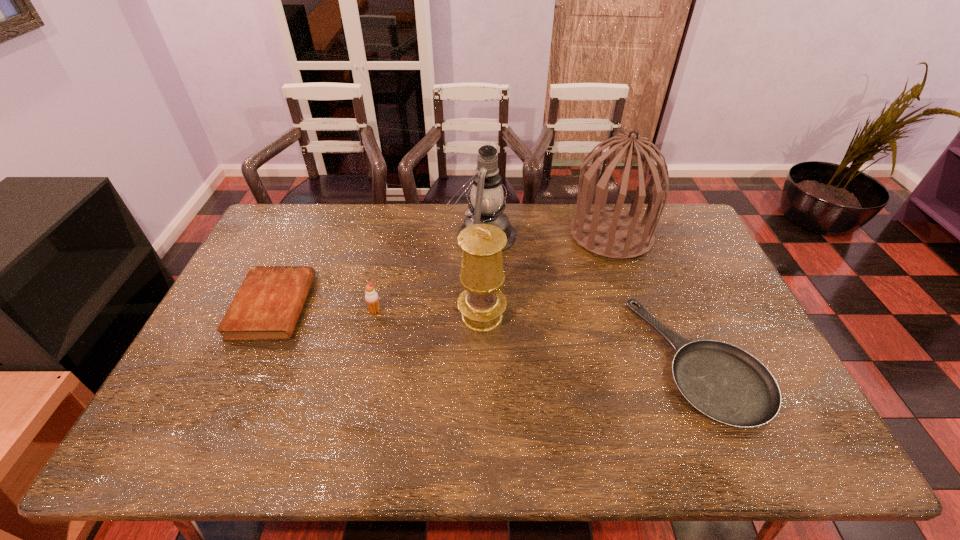
The width and height of the screenshot is (960, 540). What are the coordinates of `free region that satisfies the following two spatial constraints: 1. on the spine side of the nearer oil lamp; 2. on the left side of the Bible` in the screenshot? It's located at (268, 316).